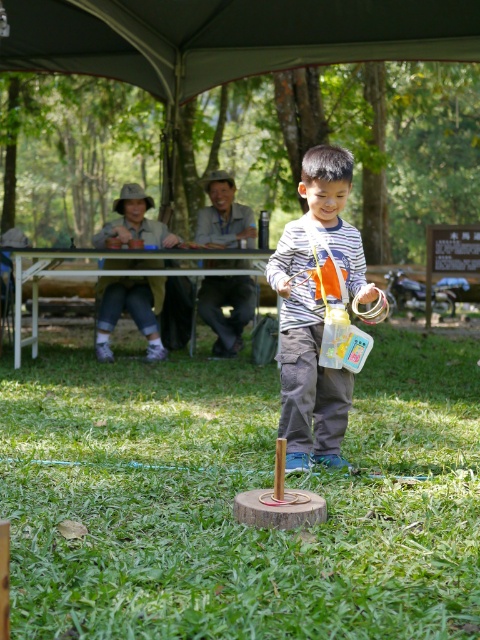
Question: Is striped fabric boy at center to the right of white plastic picnic table at upper center from the viewer's perspective?

Choices:
 (A) no
 (B) yes

Answer: (B)

Question: Is green grass at center to the right of dark gray fabric canopy at upper center from the viewer's perspective?

Choices:
 (A) no
 (B) yes

Answer: (A)

Question: Which of the following is the closest to the observer?

Choices:
 (A) (20, 276)
 (B) (233, 456)
 (C) (313, 451)
 (D) (103, 61)

Answer: (C)

Question: Which point appears closest to the camera in this image?

Choices:
 (A) (48, 269)
 (B) (252, 19)
 (C) (360, 522)
 (D) (346, 378)

Answer: (C)

Question: Which point is closer to the camera?

Choices:
 (A) striped fabric boy at center
 (B) white plastic picnic table at upper center
 (C) green grass at center

Answer: (C)

Question: From the image, what is the correct spatial relationship of dark gray fabric canopy at upper center in relation to striped fabric boy at center?

Choices:
 (A) above
 (B) below

Answer: (A)